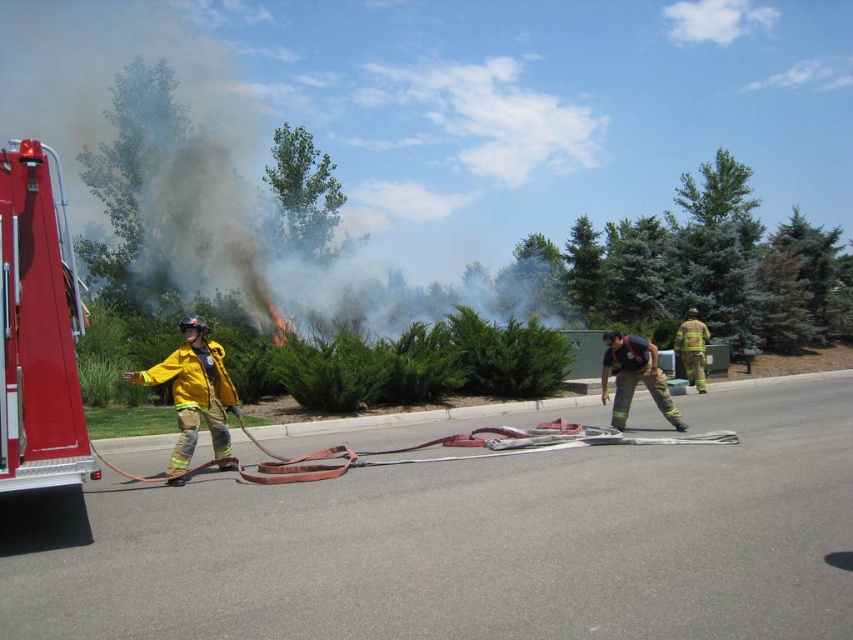
Is point (65, 440) positioned in front of point (194, 394)?

Yes, point (65, 440) is closer to viewer.

Does shiny red fire truck at left have a greater width compared to yellow fireproof suit at center?

Yes, shiny red fire truck at left is wider than yellow fireproof suit at center.

Describe the element at coordinates (38, 330) in the screenshot. The width and height of the screenshot is (853, 640). I see `shiny red fire truck at left` at that location.

Image resolution: width=853 pixels, height=640 pixels. Identify the location of shiny red fire truck at left. (38, 330).

Which is more to the left, smoketransparent at upper center or yellow fireproof suit at center?

Positioned to the left is smoketransparent at upper center.

Is smoketransparent at upper center taller than yellow fireproof suit at center?

Correct, smoketransparent at upper center is much taller as yellow fireproof suit at center.

Is point (59, 8) less distant than point (198, 390)?

No, (59, 8) is further to viewer.

Where is `smoketransparent at upper center`? smoketransparent at upper center is located at coordinates (90, 60).

Is smoketransparent at upper center thinner than yellow reflective uniform at center?

No, smoketransparent at upper center is not thinner than yellow reflective uniform at center.

Between point (183, 56) and point (683, 337), which one is positioned behind?

The point (183, 56) is more distant.

Who is more forward, (33, 45) or (704, 388)?

Point (704, 388) is in front.

Where is `smoketransparent at upper center`? This screenshot has height=640, width=853. smoketransparent at upper center is located at coordinates (90, 60).